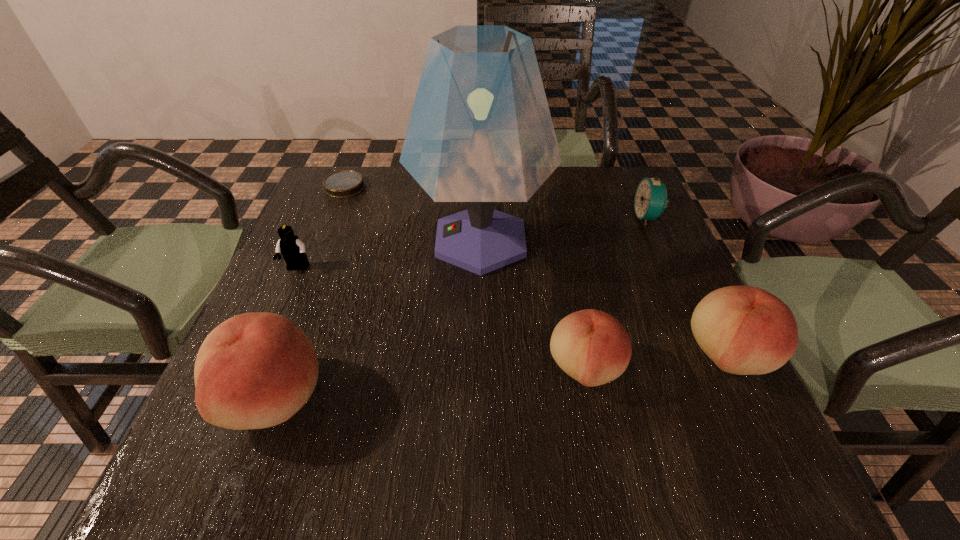
Choose which peach is the third nearest neighbor to the Lego. Please provide its 2D coordinates. Your answer should be formatted as a tuple, i.e. [(x, y)], where the tuple contains the x and y coordinates of a point satisfying the conditions above.

[(744, 330)]

Where is `free region that satisfies the following two spatial constraints: 1. on the base of the lampshade; 2. on the front-facing side of the Lego`? free region that satisfies the following two spatial constraints: 1. on the base of the lampshade; 2. on the front-facing side of the Lego is located at coordinates (481, 268).

The height and width of the screenshot is (540, 960). What are the coordinates of `vacant area in the image that satisfies the following two spatial constraints: 1. on the front-facing side of the Lego; 2. on the left side of the shortest peach` in the screenshot? It's located at (254, 368).